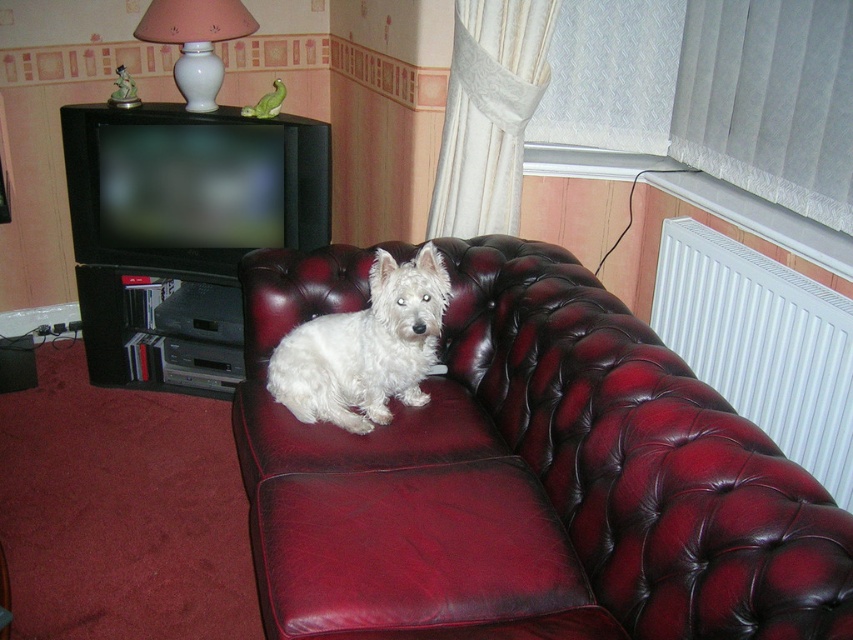
Question: Is burgundy leather couch at center closer to camera compared to white ceramic lamp at upper center?

Choices:
 (A) no
 (B) yes

Answer: (B)

Question: Which object is closer to the camera taking this photo?

Choices:
 (A) burgundy leather couch at center
 (B) white ceramic lamp at upper center
 (C) white plastic radiator at upper right
 (D) white fur dog at center

Answer: (A)

Question: In this image, where is burgundy leather couch at center located relative to white fur dog at center?

Choices:
 (A) right
 (B) left

Answer: (A)

Question: Which point appears farthest from the camera in this image?

Choices:
 (A) (730, 488)
 (B) (187, 92)
 (C) (376, 356)

Answer: (B)

Question: Among these objects, which one is nearest to the camera?

Choices:
 (A) white plastic radiator at upper right
 (B) white fur dog at center

Answer: (A)

Question: Does burgundy leather couch at center have a lesser width compared to white ceramic lamp at upper center?

Choices:
 (A) no
 (B) yes

Answer: (A)